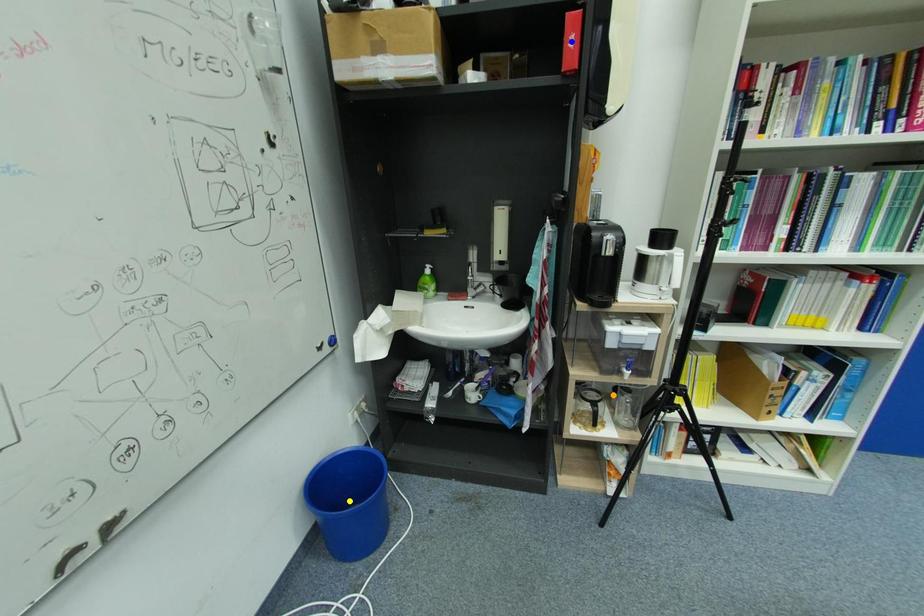
Order these from nearest to farthest:
A) blue point
B) orange point
C) yellow point

blue point, orange point, yellow point